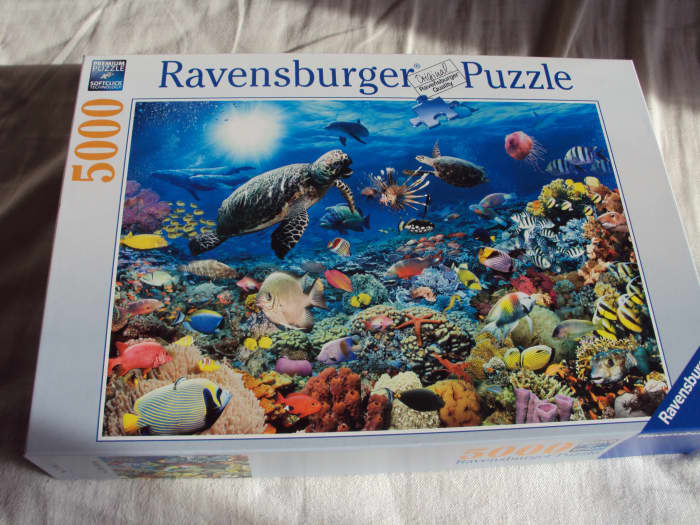
I want to click on 1 puzzle box, so click(x=92, y=372).